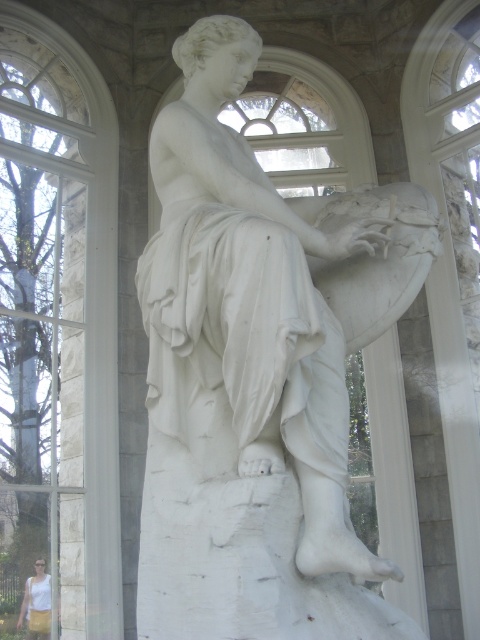
Question: Among these objects, which one is nearest to the camera?

Choices:
 (A) white cotton tank top at lower left
 (B) white marble statue at center
 (C) clear glass window at upper left

Answer: (B)

Question: Is the position of white marble statue at center more distant than that of clear glass window at upper left?

Choices:
 (A) no
 (B) yes

Answer: (A)

Question: Where is white marble statue at center located in relation to white cotton tank top at lower left in the image?

Choices:
 (A) right
 (B) left

Answer: (A)

Question: Which of the following is the closest to the observer?

Choices:
 (A) clear glass window at upper left
 (B) white marble statue at center

Answer: (B)

Question: Considering the relative positions of white marble statue at center and clear glass window at upper left in the image provided, where is white marble statue at center located with respect to clear glass window at upper left?

Choices:
 (A) below
 (B) above

Answer: (A)

Question: Which point is closer to the camera taking this photo?

Choices:
 (A) (228, 433)
 (B) (32, 620)
 (C) (72, 337)

Answer: (A)